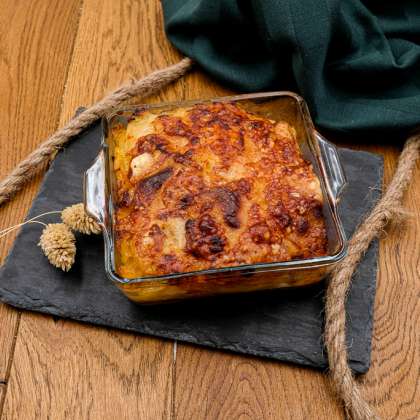
Where is `fabric`? fabric is located at coordinates (308, 40).